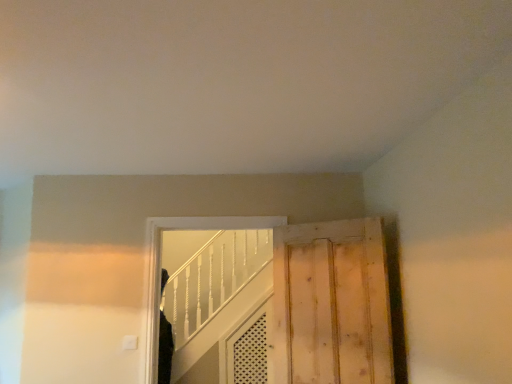
Identify the location of wooden door at upper center. This screenshot has height=384, width=512. (336, 303).

Describe the element at coordinates (336, 303) in the screenshot. The height and width of the screenshot is (384, 512). I see `wooden door at upper center` at that location.

Based on the photo, what is the approximate height of wooden door at upper center?

wooden door at upper center is 3.49 feet tall.

The height and width of the screenshot is (384, 512). What are the coordinates of `wooden door at upper center` in the screenshot? It's located at (336, 303).